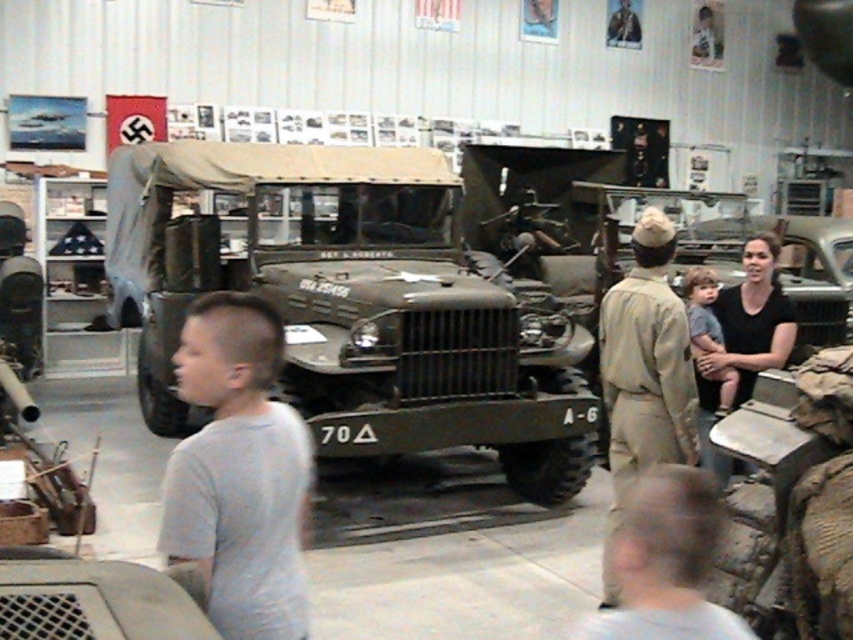
Question: Does gray cotton shirt at center have a larger size compared to matte green military vehicle at center?

Choices:
 (A) no
 (B) yes

Answer: (A)

Question: Which point is farther from the camera taking this photo?

Choices:
 (A) (643, 230)
 (B) (641, 566)

Answer: (A)

Question: Which of the following is the farthest from the observer?

Choices:
 (A) (701, 406)
 (B) (676, 461)

Answer: (A)

Question: Which of the following is the farthest from the observer?

Choices:
 (A) (430, 444)
 (B) (637, 602)

Answer: (A)

Question: Is matte green truck at center to the left of tan uniform at center from the viewer's perspective?

Choices:
 (A) yes
 (B) no

Answer: (A)

Question: Is light brown hair at center to the right of black cotton shirt at right from the viewer's perspective?

Choices:
 (A) no
 (B) yes

Answer: (A)